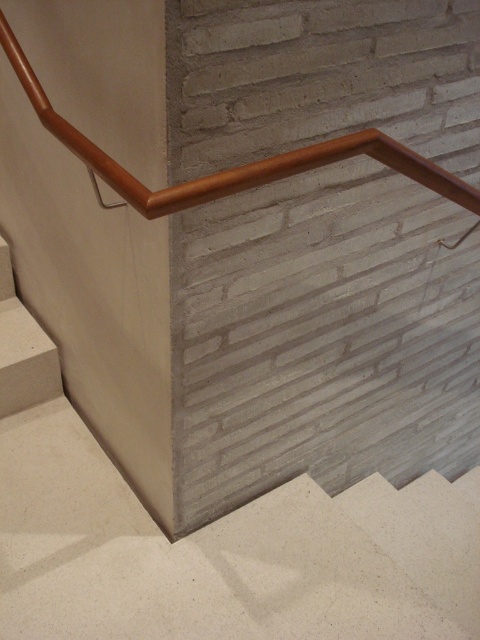
Question: Does wooden handrail at upper center appear under white concrete stair at lower left?

Choices:
 (A) no
 (B) yes

Answer: (A)

Question: Which point appears closest to the camera in this image?

Choices:
 (A) (47, 348)
 (B) (152, 218)

Answer: (B)

Question: Among these points, which one is nearest to the camera?

Choices:
 (A) (199, 188)
 (B) (34, 392)

Answer: (A)

Question: Which point is farther to the camera?

Choices:
 (A) wooden handrail at upper center
 (B) white concrete stair at lower left

Answer: (B)

Question: Is wooden handrail at upper center in front of white concrete stair at lower left?

Choices:
 (A) no
 (B) yes

Answer: (B)

Question: From the image, what is the correct spatial relationship of wooden handrail at upper center in relation to white concrete stair at lower left?

Choices:
 (A) left
 (B) right

Answer: (B)